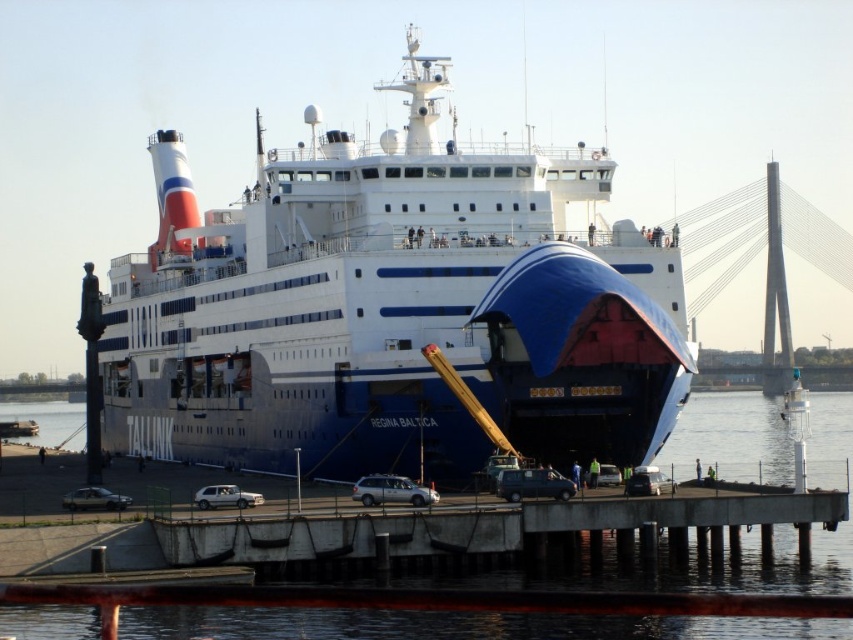
Can you confirm if concrete at center is positioned above silver metallic sedan at lower left?

Incorrect, concrete at center is not positioned above silver metallic sedan at lower left.

Is concrete at center thinner than silver metallic sedan at lower left?

In fact, concrete at center might be wider than silver metallic sedan at lower left.

Does point (647, 513) lie behind point (102, 490)?

No, (647, 513) is closer to viewer.

Where is `concrete at center`? The width and height of the screenshot is (853, 640). concrete at center is located at coordinates (474, 525).

Which of these two, silver metallic sedan at lower left or metallic silver car at lower center, stands taller?

silver metallic sedan at lower left is taller.

Locate an element on the screen. This screenshot has height=640, width=853. silver metallic sedan at lower left is located at coordinates (x=94, y=499).

Is white glossy ship at center thinner than concrete at center?

No.

Which of these two, white glossy ship at center or concrete at center, stands shorter?

concrete at center

Between point (489, 179) and point (171, 531), which one is positioned behind?

Positioned behind is point (489, 179).

You are a GUI agent. You are given a task and a screenshot of the screen. Output one action in this format:
    pyautogui.click(x=<x>, y=<y>)
    Task: Click on the white glossy ship at center
    Image resolution: width=853 pixels, height=640 pixels.
    Given the screenshot: What is the action you would take?
    pyautogui.click(x=392, y=308)